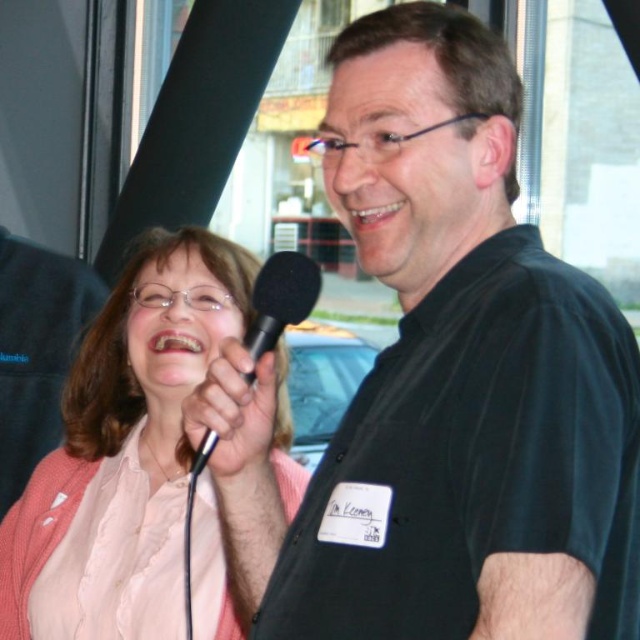
Question: Is black matte shirt at center further to the viewer compared to pink fabric at upper left?

Choices:
 (A) yes
 (B) no

Answer: (B)

Question: Which object is the farthest from the black matte shirt at center?

Choices:
 (A) pink fabric at upper left
 (B) black matte microphone at center

Answer: (A)

Question: Is black matte shirt at center to the right of black matte microphone at center from the viewer's perspective?

Choices:
 (A) no
 (B) yes

Answer: (B)

Question: Estimate the real-world distances between objects in this image. Which object is farther from the pink fabric at upper left?

Choices:
 (A) black matte shirt at center
 (B) black matte microphone at center

Answer: (A)

Question: Can you confirm if pink fabric at upper left is positioned above black matte microphone at center?

Choices:
 (A) yes
 (B) no

Answer: (B)

Question: Which point is closer to the camera?

Choices:
 (A) (472, 566)
 (B) (115, 561)
 (C) (305, 259)

Answer: (A)